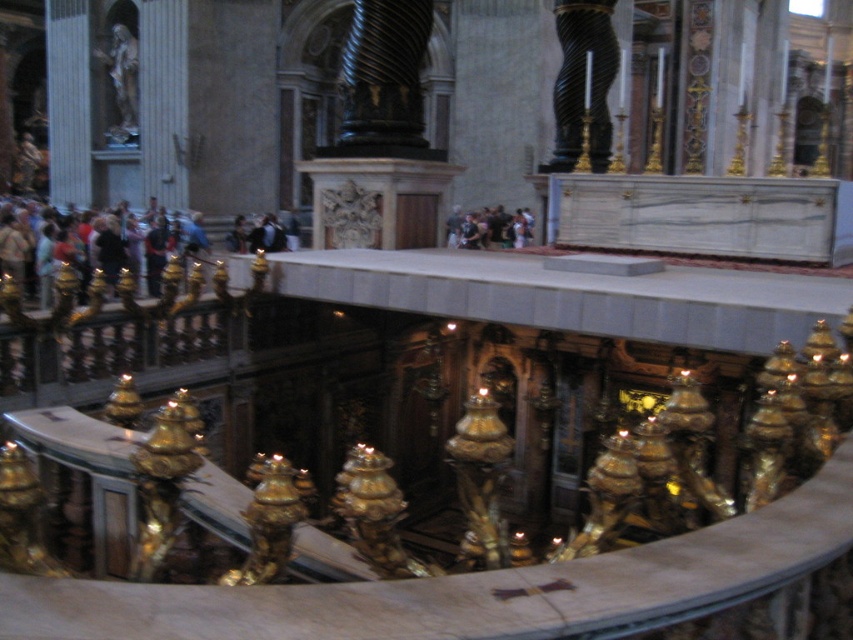
Question: Among these objects, which one is farthest from the camera?

Choices:
 (A) matte black jacket at left
 (B) dark clothing at center
 (C) matte gold statue at center

Answer: (B)

Question: Which of the following is the closest to the observer?

Choices:
 (A) dark clothing at center
 (B) matte gold statue at center
 (C) matte black jacket at left

Answer: (C)

Question: Does matte black jacket at left appear on the left side of matte gold statue at center?

Choices:
 (A) yes
 (B) no

Answer: (A)

Question: Can you confirm if matte gold statue at center is bigger than dark clothing at center?

Choices:
 (A) no
 (B) yes

Answer: (B)

Question: Which point appears closest to the camera in this image?

Choices:
 (A) (25, 230)
 (B) (260, 225)

Answer: (A)

Question: Is matte black jacket at left above matte gold statue at center?

Choices:
 (A) no
 (B) yes

Answer: (A)